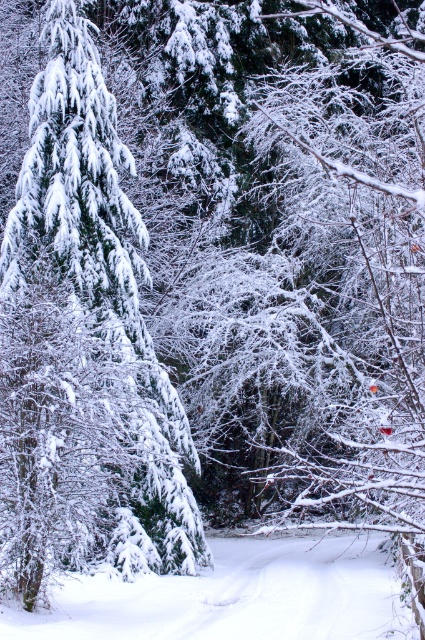
Question: Can you confirm if green matte tree at left is thinner than white fluffy snow at center?

Choices:
 (A) no
 (B) yes

Answer: (B)

Question: Which point is farther to the camera?

Choices:
 (A) (232, 544)
 (B) (173, 524)

Answer: (A)

Question: Can you confirm if green matte tree at left is positioned below white fluffy snow at center?

Choices:
 (A) no
 (B) yes

Answer: (A)

Question: Does green matte tree at left appear on the left side of white fluffy snow at center?

Choices:
 (A) yes
 (B) no

Answer: (A)

Question: Which point is closer to the camera?

Choices:
 (A) (85, 592)
 (B) (116, 531)

Answer: (A)